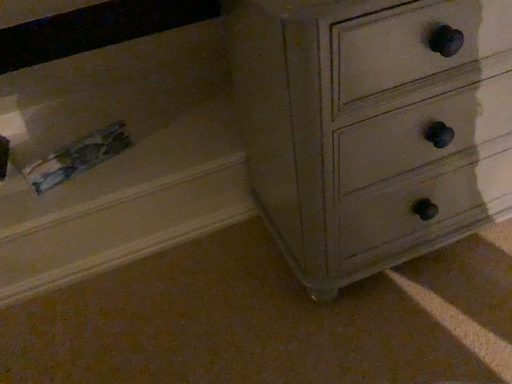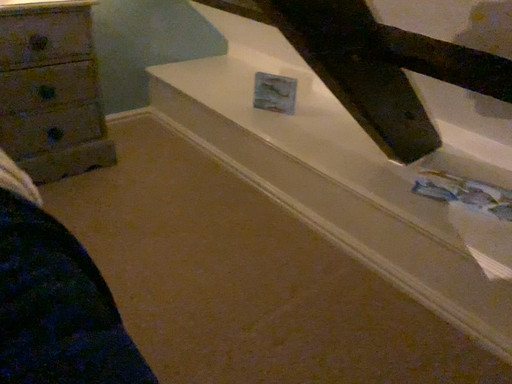
Question: Which way did the camera rotate in the video?

Choices:
 (A) rotated upward
 (B) rotated downward

Answer: (A)